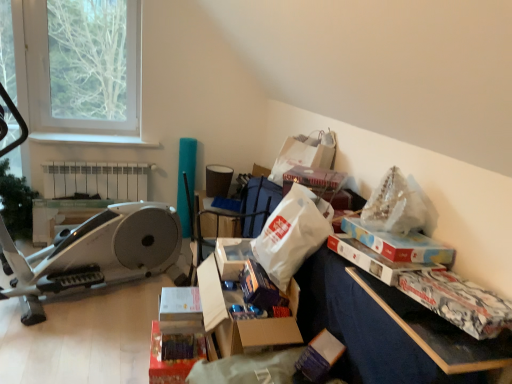
What are the coordinates of `free spot below translucent plastic bag at upper right, the third paper bag when ordered from back to front (from a real-world perspective)` in the screenshot? It's located at (390, 231).